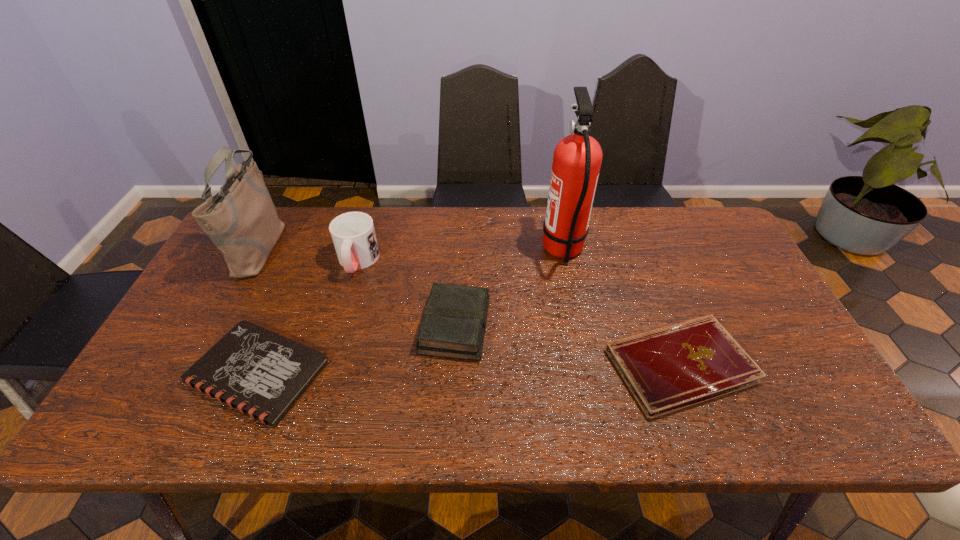
Where is `free space between the shoulder bag and the tallest object`? The width and height of the screenshot is (960, 540). free space between the shoulder bag and the tallest object is located at coordinates (412, 248).

The image size is (960, 540). In order to click on empty space between the left notebook and the fifth shortest object in this screenshot , I will do `click(259, 309)`.

Identify the location of free space between the third shortest object and the fire extinguisher. (509, 288).

In order to click on vacant space that's between the second tallest object and the mug in this screenshot , I will do `click(309, 254)`.

Where is `free area in between the mug and the left notebook`? free area in between the mug and the left notebook is located at coordinates (307, 317).

I want to click on vacant point located between the fire extinguisher and the mug, so click(460, 256).

Where is `free spot between the tallest object and the right notebook`? free spot between the tallest object and the right notebook is located at coordinates (621, 308).

This screenshot has width=960, height=540. I want to click on empty space that is in between the mug and the tallest object, so click(460, 256).

This screenshot has height=540, width=960. What are the coordinates of `object identified as the second closest to the fourth object from left to right` in the screenshot? It's located at (577, 158).

Select which object is the closest to the fire extinguisher. Please provide its 2D coordinates. Your answer should be formatted as a tuple, i.e. [(x, y)], where the tuple contains the x and y coordinates of a point satisfying the conditions above.

[(667, 369)]